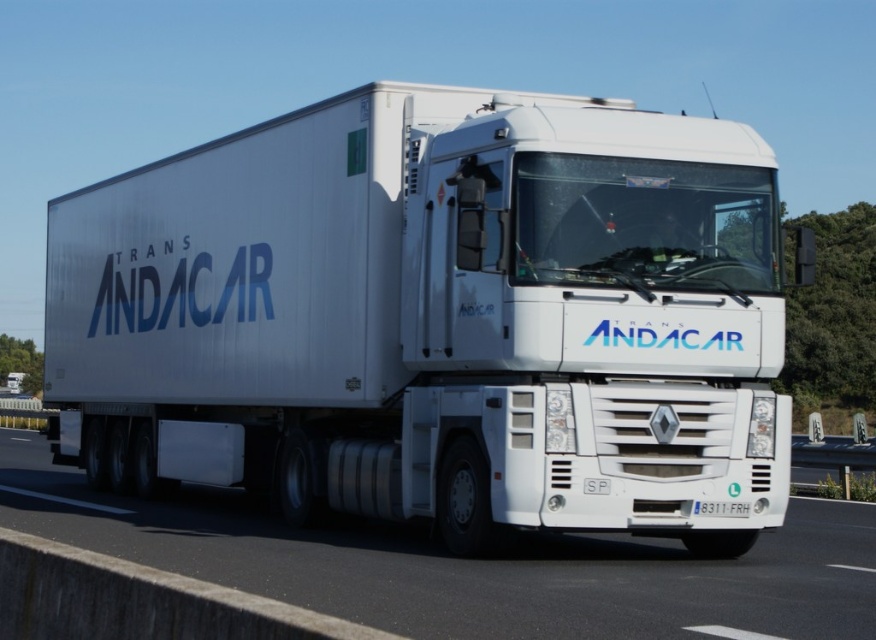
Which is more to the left, white glossy truck at center or white plastic license plate at center?

Positioned to the left is white plastic license plate at center.

Looking at this image, between white glossy truck at center and white plastic license plate at center, which one is positioned higher?

white glossy truck at center is higher up.

What are the coordinates of `white glossy truck at center` in the screenshot? It's located at (436, 317).

Can you confirm if white asphalt road at center is positioned below white plastic license plate at center?

Yes, white asphalt road at center is below white plastic license plate at center.

Is white asphalt road at center positioned behind white plastic license plate at center?

No, it is not.

What do you see at coordinates (471, 564) in the screenshot?
I see `white asphalt road at center` at bounding box center [471, 564].

This screenshot has width=876, height=640. I want to click on white asphalt road at center, so click(x=471, y=564).

Is white glossy truck at center thinner than white asphalt road at center?

No.

Image resolution: width=876 pixels, height=640 pixels. I want to click on white glossy truck at center, so click(436, 317).

What are the coordinates of `white glossy truck at center` in the screenshot? It's located at (436, 317).